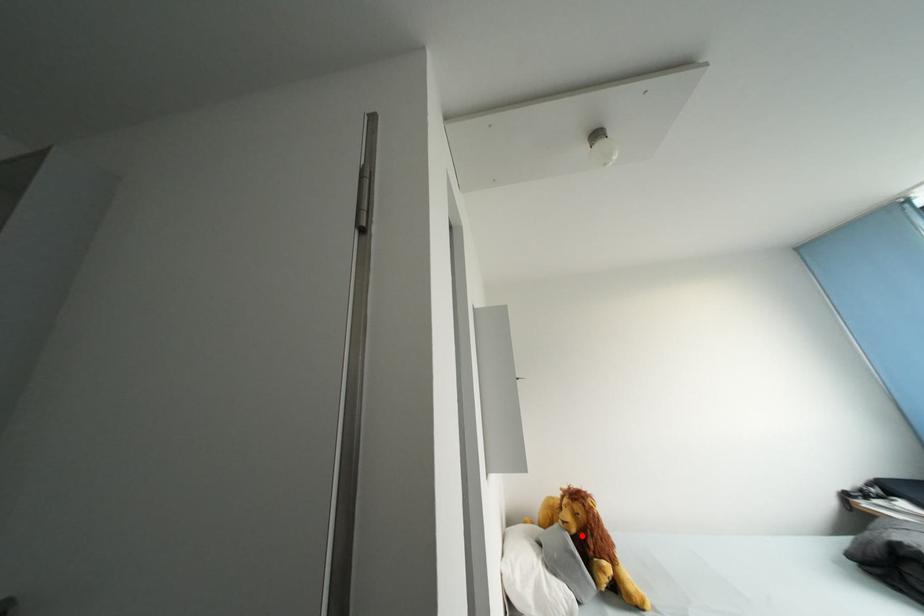
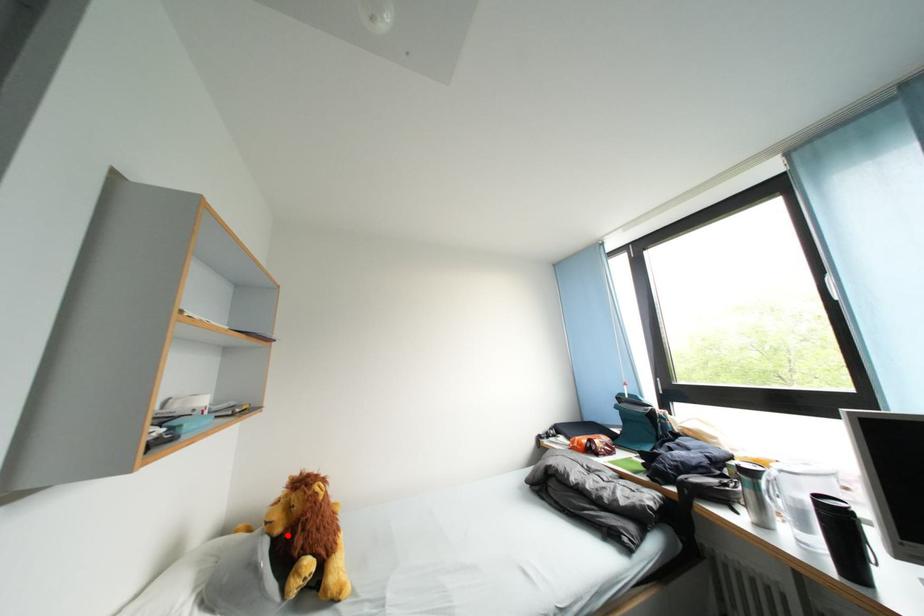
I am providing you with two images of the same scene from different viewpoints. A red point is marked on the first image and another point is marked on the second image. Are the points marked in image1 and image2 representing the same 3D position?

Yes